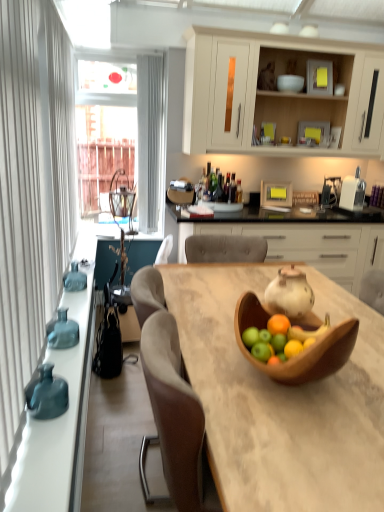
At what (x,y) coordinates should I click in order to perform the action: click on matte white cabinet at upper center, which appears as the second cabinetry when ordered from the bottom. Please return your answer as a coordinate pair (x, y). The image size is (384, 512). Looking at the image, I should click on (256, 92).

Measure the distance between point (312, 196) and camera.

Point (312, 196) is 3.63 meters away from camera.

Locate an element on the screen. white matte cabinet at center, positioned as the 1th cabinetry in bottom-to-top order is located at coordinates (299, 240).

The image size is (384, 512). I want to click on teal glass bottles at left, so 58,424.

You are a GUI agent. You are given a task and a screenshot of the screen. Output one action in this format:
    pyautogui.click(x=<x>, y=<y>)
    Task: Click on the matte blue vase at left, the third vase viewed from the back
    Image resolution: width=384 pixels, height=512 pixels.
    Given the screenshot: What is the action you would take?
    pyautogui.click(x=47, y=394)

This screenshot has width=384, height=512. Find the location of `matte white cabinet at upper center, which appears as the second cabinetry when ordered from the bottom`. matte white cabinet at upper center, which appears as the second cabinetry when ordered from the bottom is located at coordinates (256, 92).

Which of these two, wooden bowl at center or teal glass vase at left, which is counted as the first vase, starting from the back, is thinner?

With smaller width is teal glass vase at left, which is counted as the first vase, starting from the back.

From the image's perspective, who appears lower, wooden bowl at center or teal glass vase at left, the 1th vase viewed from the top?

wooden bowl at center is shown below in the image.

Is teal glass vase at left, which appears as the 3th vase when viewed from the front, at the back of wooden bowl at center?

No, teal glass vase at left, which appears as the 3th vase when viewed from the front, is not at the back of wooden bowl at center.

Is teal glass vase at left, the 1th vase viewed from the top, wider or thinner than teal glass vase at left, which is the second vase in top-to-bottom order?

Considering their sizes, teal glass vase at left, the 1th vase viewed from the top, looks broader than teal glass vase at left, which is the second vase in top-to-bottom order.

Is teal glass vase at left, which is the third vase in bottom-to-top order, completely or partially outside of teal glass vase at left, which is the second vase in top-to-bottom order?

Yes, teal glass vase at left, which is the third vase in bottom-to-top order, is located beyond the bounds of teal glass vase at left, which is the second vase in top-to-bottom order.

Does point (75, 269) come in front of point (75, 333)?

No.

Which point is more forward, (291, 267) or (366, 367)?

The point (366, 367) is in front.

Is matte white teapot at center surrounding wooden table at center?

No.

Which object is further away from the camera, matte white teapot at center or wooden table at center?

matte white teapot at center is behind.

Can you confirm if matte white teapot at center is bigger than wooden table at center?

Incorrect, matte white teapot at center is not larger than wooden table at center.

Who is taller, matte white teapot at center or teal glass vase at left, which is the third vase in bottom-to-top order?

With more height is matte white teapot at center.

From a real-world perspective, is matte white teapot at center physically below teal glass vase at left, the 1th vase viewed from the top?

No.

Is matte white teapot at center placed right next to teal glass vase at left, which appears as the 3th vase when viewed from the front?

No, matte white teapot at center is not in contact with teal glass vase at left, which appears as the 3th vase when viewed from the front.

From the image's perspective, is matte white teapot at center located above or below teal glass vase at left, the 1th vase viewed from the top?

matte white teapot at center is below teal glass vase at left, the 1th vase viewed from the top.

Which of these two, wooden bowl at center or matte blue vase at left, which ranks as the 3th vase in top-to-bottom order, is wider?

wooden bowl at center.

Is matte blue vase at left, which is counted as the 1th vase, starting from the bottom, located within wooden bowl at center?

No, matte blue vase at left, which is counted as the 1th vase, starting from the bottom, is located outside of wooden bowl at center.

From a real-world perspective, between wooden bowl at center and matte blue vase at left, which is the first vase in front-to-back order, who is vertically lower?

In real-world perspective, matte blue vase at left, which is the first vase in front-to-back order, is lower.

From the image's perspective, relative to matte blue vase at left, which is counted as the 1th vase, starting from the bottom, is wooden bowl at center above or below?

From the image's perspective, wooden bowl at center appears above matte blue vase at left, which is counted as the 1th vase, starting from the bottom.

From the image's perspective, relative to wooden bowl at center, is teal glass vase at left, the 2th vase positioned from the front, above or below?

teal glass vase at left, the 2th vase positioned from the front, is below wooden bowl at center.

Considering the points (53, 333) and (337, 345), which point is behind, point (53, 333) or point (337, 345)?

The point (53, 333) is farther.

Based on the photo, between teal glass vase at left, which is the second vase in top-to-bottom order, and wooden bowl at center, which one has larger size?

wooden bowl at center is bigger.

Which is correct: matte white cabinet at upper center, which appears as the second cabinetry when ordered from the bottom, is inside wooden bowl at center, or outside of it?

matte white cabinet at upper center, which appears as the second cabinetry when ordered from the bottom, exists outside the volume of wooden bowl at center.

Which is more to the right, matte white cabinet at upper center, which appears as the second cabinetry when ordered from the bottom, or wooden bowl at center?

Positioned to the right is matte white cabinet at upper center, which appears as the second cabinetry when ordered from the bottom.

Is matte white cabinet at upper center, marked as the first cabinetry in a top-to-bottom arrangement, facing away from wooden bowl at center?

No, matte white cabinet at upper center, marked as the first cabinetry in a top-to-bottom arrangement, is not facing away from wooden bowl at center.

Are matte white cabinet at upper center, marked as the first cabinetry in a top-to-bottom arrangement, and wooden bowl at center making contact?

No, matte white cabinet at upper center, marked as the first cabinetry in a top-to-bottom arrangement, is not touching wooden bowl at center.

Where is `tableware positioned vertically above the teal glass vase at left, which is the third vase in bottom-to-top order (from a real-world perspective)`? tableware positioned vertically above the teal glass vase at left, which is the third vase in bottom-to-top order (from a real-world perspective) is located at coordinates (303, 351).

This screenshot has width=384, height=512. Identify the location of vase that is on the left side of teal glass vase at left, the 2th vase positioned from the front. (74, 279).

Consider the image. Looking at the image, which one is located closer to teal glass vase at left, which is counted as the 2th vase, starting from the back, wooden bowl at center or teal glass bottles at left?

Among the two, teal glass bottles at left is located nearer to teal glass vase at left, which is counted as the 2th vase, starting from the back.

From the picture: From the image, which object appears to be nearer to white matte cabinet at center, positioned as the 1th cabinetry in bottom-to-top order, wooden table at center or teal glass bottles at left?

wooden table at center.

Estimate the real-world distances between objects in this image. Which object is further from wooden bowl at center, white matte cabinet at center, the 2th cabinetry viewed from the top, or teal glass vase at left, marked as the 2th vase in a bottom-to-top arrangement?

teal glass vase at left, marked as the 2th vase in a bottom-to-top arrangement, is further to wooden bowl at center.

In the scene shown: From the image, which object appears to be farther from matte white cabinet at upper center, which appears as the second cabinetry when ordered from the bottom, teal glass vase at left, which is the second vase in top-to-bottom order, or wooden bowl at center?

teal glass vase at left, which is the second vase in top-to-bottom order.

Estimate the real-world distances between objects in this image. Which object is further from teal glass vase at left, teal glass bottles at left or matte white teapot at center?

matte white teapot at center.

Based on their spatial positions, is wooden bowl at center or wooden table at center closer to white matte cabinet at center, the 2th cabinetry viewed from the top?

wooden bowl at center is closer to white matte cabinet at center, the 2th cabinetry viewed from the top.

From the picture: Based on their spatial positions, is wooden table at center or teal glass vase at left, which is the third vase in bottom-to-top order, closer to wooden bowl at center?

wooden table at center lies closer to wooden bowl at center than the other object.

Which object lies nearer to the anchor point teal glass vase at left, which is the third vase in bottom-to-top order, wooden bowl at center or wooden bowl at center?

wooden bowl at center.

Identify the location of cabinetry between teal glass vase at left, which is counted as the first vase, starting from the back, and matte white cabinet at upper center, marked as the first cabinetry in a top-to-bottom arrangement, from left to right. The image size is (384, 512). (299, 240).

You are a GUI agent. You are given a task and a screenshot of the screen. Output one action in this format:
    pyautogui.click(x=<x>, y=<y>)
    Task: Click on the tea pot between matte white cabinet at upper center, which appears as the second cabinetry when ordered from the bottom, and teal glass vase at left, which is counted as the 2th vase, starting from the back, from top to bottom
    The width and height of the screenshot is (384, 512).
    Given the screenshot: What is the action you would take?
    pyautogui.click(x=289, y=293)

Identify the location of countertop positioned between wooden table at center and matte white cabinet at upper center, marked as the first cabinetry in a top-to-bottom arrangement, from near to far. The image size is (384, 512). (58, 424).

Where is `countertop between wooden table at center and teal glass vase at left, the 1th vase viewed from the top, along the z-axis`? Image resolution: width=384 pixels, height=512 pixels. countertop between wooden table at center and teal glass vase at left, the 1th vase viewed from the top, along the z-axis is located at coordinates (58, 424).